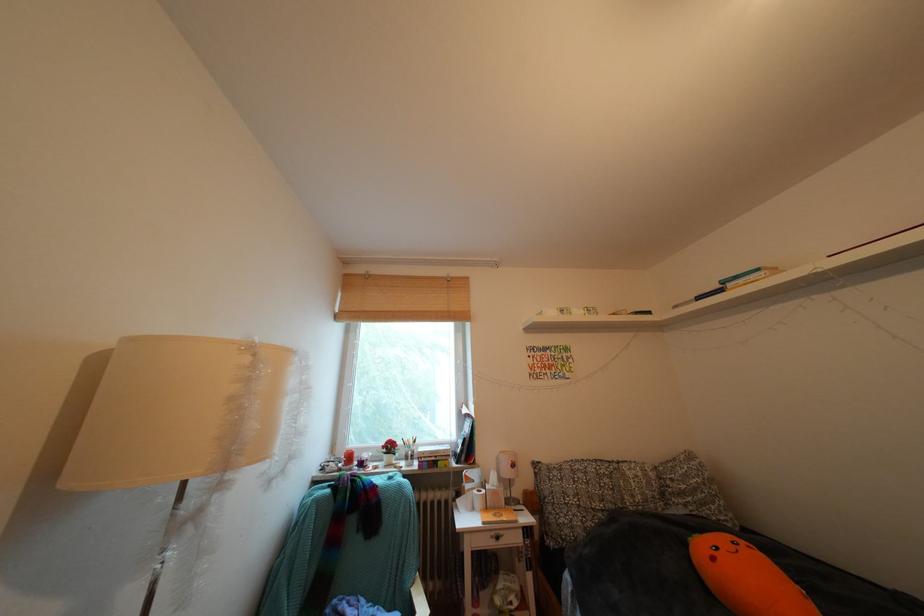
Describe the element at coordinates (402, 283) in the screenshot. I see `the window blind cord` at that location.